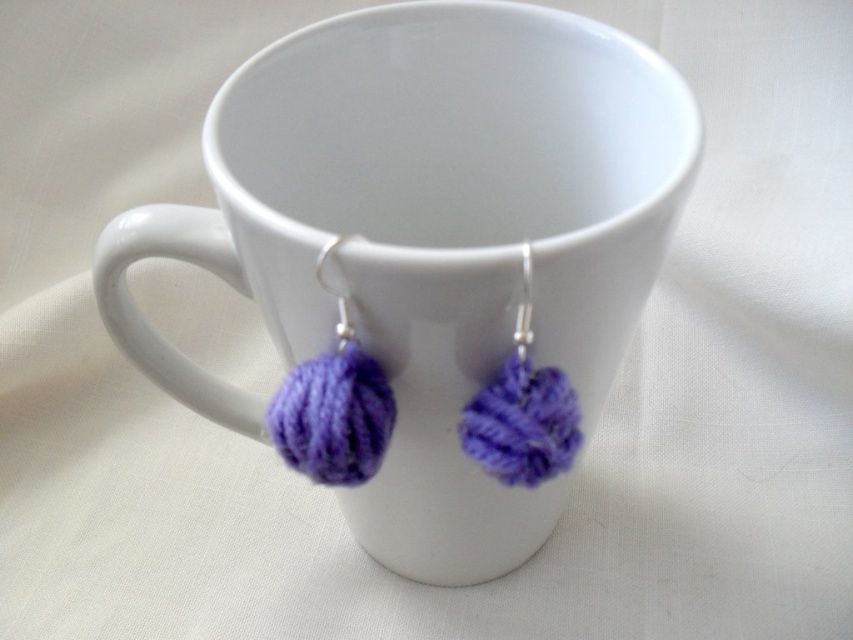
You are organizing a small craft fair and have a display table. You need to place the white ceramic mug at center and the purple yarn ball at center next to each other. Which object should you place first to ensure there is enough space for both?

The white ceramic mug at center is wider than the purple yarn ball at center, so you should place the white ceramic mug at center first to ensure there is enough space for both.